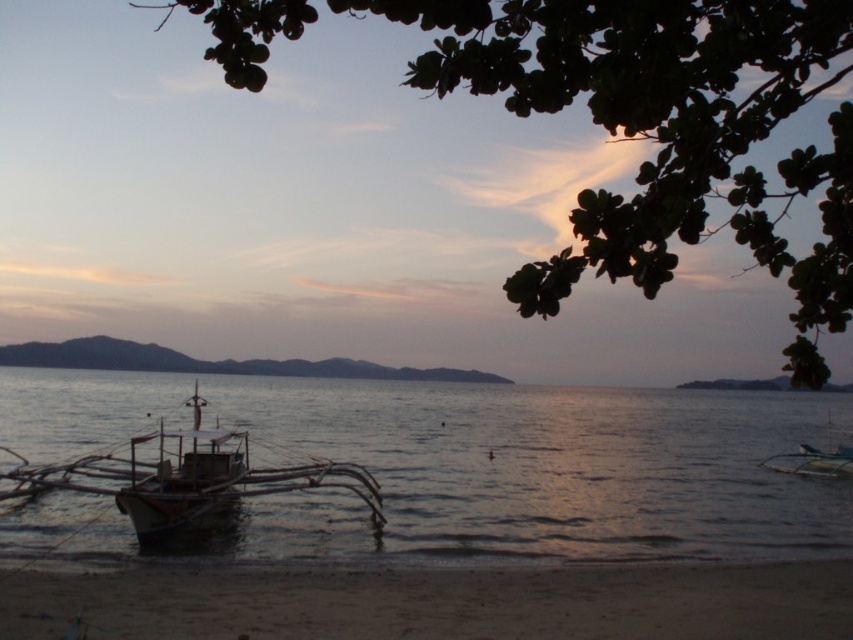
Who is higher up, green leafy tree at upper center or wooden boat at lower left?

green leafy tree at upper center is above.

Is green leafy tree at upper center thinner than wooden boat at lower left?

No.

This screenshot has height=640, width=853. I want to click on green leafy tree at upper center, so click(x=664, y=131).

Can you confirm if wooden boat at lower left is positioned to the right of wooden sailboat at right?

No, wooden boat at lower left is not to the right of wooden sailboat at right.

Is wooden boat at lower left below wooden sailboat at right?

No, wooden boat at lower left is not below wooden sailboat at right.

Where is `wooden boat at lower left`? This screenshot has height=640, width=853. wooden boat at lower left is located at coordinates (184, 477).

Is sandy beach at lower left below wooden sailboat at right?

Actually, sandy beach at lower left is above wooden sailboat at right.

Between sandy beach at lower left and wooden sailboat at right, which one has more height?

wooden sailboat at right

Is point (822, 628) more distant than point (840, 454)?

No, it is not.

Find the location of `sandy beach at lower left`. sandy beach at lower left is located at coordinates (436, 602).